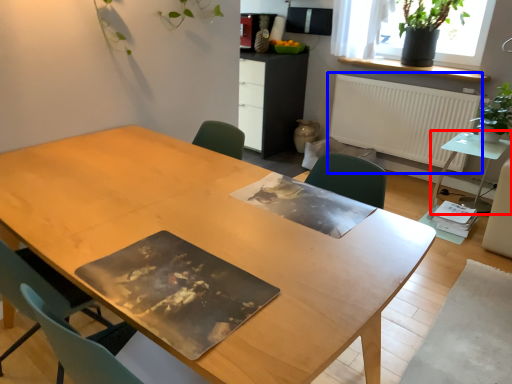
Question: Among these objects, which one is farthest to the camera, table (highlighted by a red box) or radiator (highlighted by a blue box)?

Choices:
 (A) table
 (B) radiator

Answer: (B)